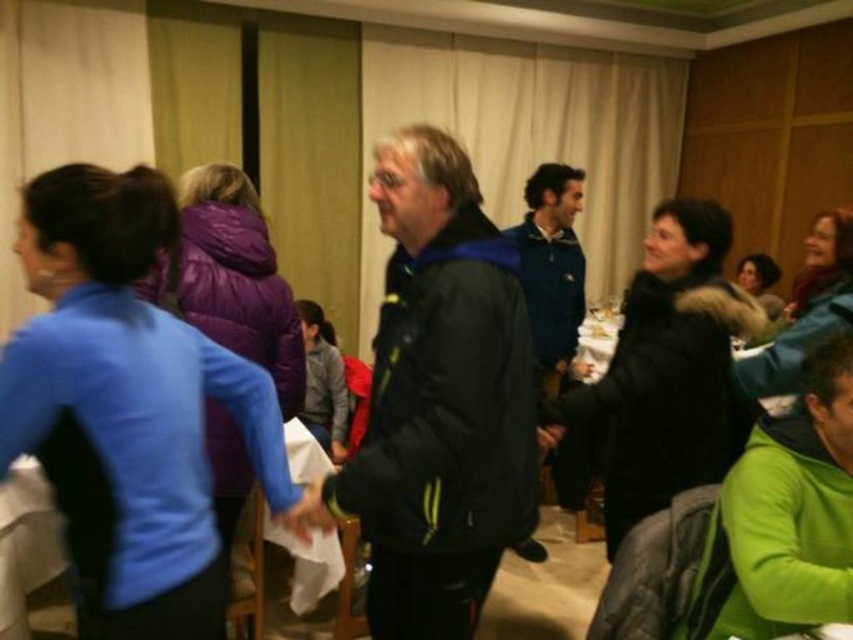
You are organizing a presentation and need to place the white paper at center and the blue fleece jacket at center on a shelf. Which object should you place first to ensure both fit properly?

The white paper at center has a lesser height compared to the blue fleece jacket at center. You should place the taller blue fleece jacket at center first to avoid it blocking the view of the shorter white paper at center.

You are standing at the point marked as point [439,401] in the image. What object is located exactly at that point?

The black jacket at center is located exactly at point [439,401].

You are organizing a presentation and need to place a name tag on the white paper at center. The name tag is attached to the green fleece jacket at lower right. Can you place the name tag on the paper without moving the jacket?

The green fleece jacket at lower right is positioned on the right side of the white paper at center. Since the jacket is already to the right of the paper, you can easily place the name tag on the white paper at center without moving the jacket.